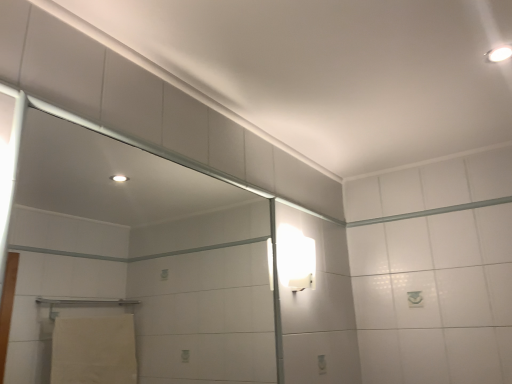
Question: Which is correct: white glossy wall sconce at upper right, which is the 1th light fixture from left to right, is inside transparent glass screen door at upper left, or outside of it?

Choices:
 (A) outside
 (B) inside

Answer: (A)

Question: Is white glossy wall sconce at upper right, which is the 1th light fixture from left to right, wider or thinner than transparent glass screen door at upper left?

Choices:
 (A) wide
 (B) thin

Answer: (A)

Question: Which of these objects is positioned farthest from the transparent glass screen door at upper left?

Choices:
 (A) white glossy wall sconce at upper right, which is counted as the second light fixture, starting from the right
 (B) white glossy light fixture at upper right, the first light fixture positioned from the top

Answer: (B)

Question: Which object is positioned farthest from the transparent glass screen door at upper left?

Choices:
 (A) white glossy wall sconce at upper right, the 1th light fixture positioned from the back
 (B) white glossy light fixture at upper right, the 1th light fixture viewed from the right

Answer: (B)